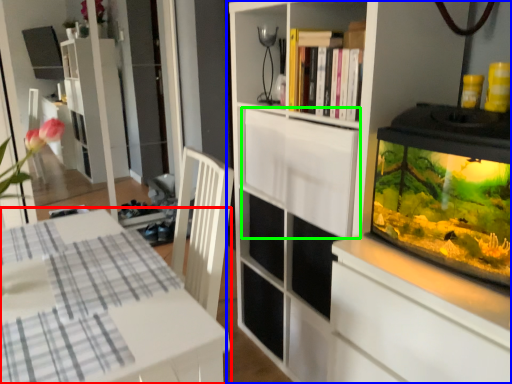
Question: Which is farther away from table (highlighted by a red box)? cupboard (highlighted by a blue box) or cabinetry (highlighted by a green box)?

Choices:
 (A) cupboard
 (B) cabinetry

Answer: (A)